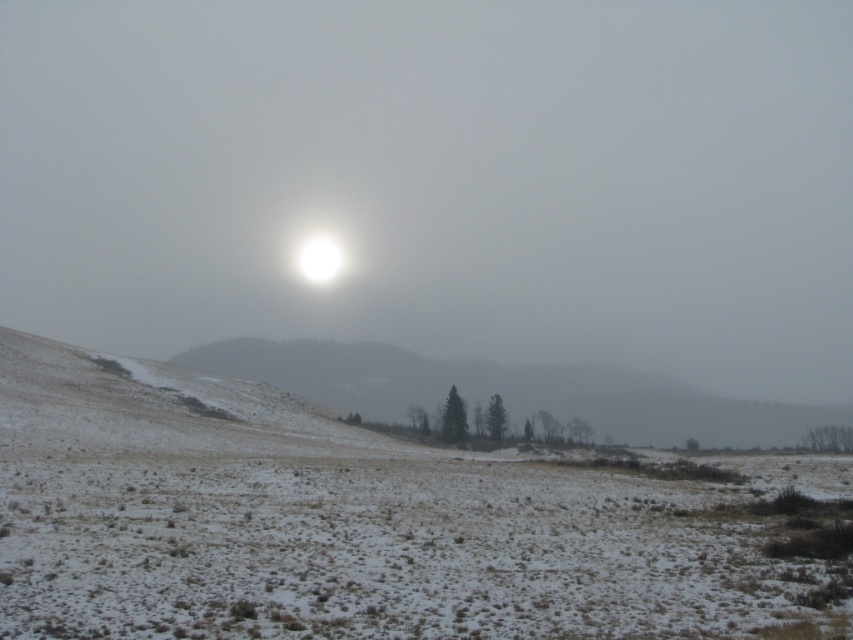
Question: In this image, where is white snow-covered field at center located relative to snowy grassy hill at center?

Choices:
 (A) left
 (B) right

Answer: (A)

Question: Can you confirm if white snow-covered field at center is smaller than snowy grassy hill at center?

Choices:
 (A) yes
 (B) no

Answer: (A)

Question: Is white snow-covered field at center below snowy grassy hill at center?

Choices:
 (A) no
 (B) yes

Answer: (A)

Question: Which point appears closest to the camera in this image?

Choices:
 (A) (776, 566)
 (B) (589, 413)

Answer: (A)

Question: Which point appears farthest from the camera in this image?

Choices:
 (A) (717, 568)
 (B) (561, 390)

Answer: (B)

Question: Which point is farther from the camera taking this photo?

Choices:
 (A) (610, 481)
 (B) (561, 371)

Answer: (B)